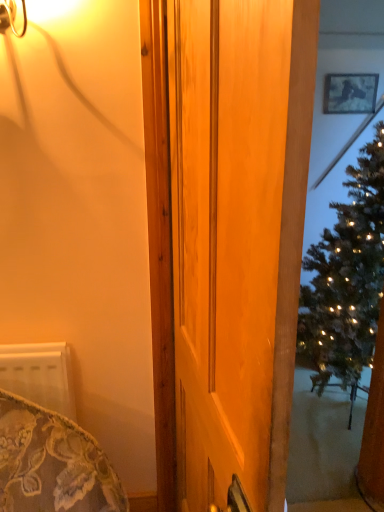
Question: Does metallic silver picture frame at upper right appear on the right side of wooden door at center?

Choices:
 (A) no
 (B) yes

Answer: (B)

Question: Considering the relative sizes of metallic silver picture frame at upper right and wooden door at center in the image provided, is metallic silver picture frame at upper right taller than wooden door at center?

Choices:
 (A) no
 (B) yes

Answer: (A)

Question: From a real-world perspective, is metallic silver picture frame at upper right located higher than wooden door at center?

Choices:
 (A) yes
 (B) no

Answer: (A)

Question: Does metallic silver picture frame at upper right appear on the left side of wooden door at center?

Choices:
 (A) yes
 (B) no

Answer: (B)

Question: From the image's perspective, is metallic silver picture frame at upper right under wooden door at center?

Choices:
 (A) no
 (B) yes

Answer: (A)

Question: Would you consider metallic silver picture frame at upper right to be distant from wooden door at center?

Choices:
 (A) yes
 (B) no

Answer: (A)

Question: Are wooden door at center and metallic silver picture frame at upper right far apart?

Choices:
 (A) yes
 (B) no

Answer: (A)

Question: From a real-world perspective, does wooden door at center sit lower than metallic silver picture frame at upper right?

Choices:
 (A) no
 (B) yes

Answer: (B)

Question: Considering the relative sizes of wooden door at center and metallic silver picture frame at upper right in the image provided, is wooden door at center smaller than metallic silver picture frame at upper right?

Choices:
 (A) yes
 (B) no

Answer: (B)

Question: Is the depth of wooden door at center less than that of metallic silver picture frame at upper right?

Choices:
 (A) yes
 (B) no

Answer: (A)

Question: Would you say metallic silver picture frame at upper right is part of wooden door at center's contents?

Choices:
 (A) no
 (B) yes

Answer: (A)

Question: Is wooden door at center directly adjacent to metallic silver picture frame at upper right?

Choices:
 (A) no
 (B) yes

Answer: (A)

Question: From the image's perspective, is wooden door at center positioned above or below metallic silver picture frame at upper right?

Choices:
 (A) above
 (B) below

Answer: (B)